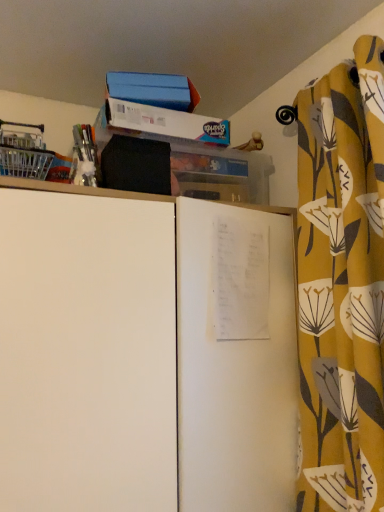
Question: In terms of size, does white matte cabinet at center appear bigger or smaller than yellow floral fabric curtain at right?

Choices:
 (A) big
 (B) small

Answer: (A)

Question: From a real-world perspective, is white matte cabinet at center positioned above or below yellow floral fabric curtain at right?

Choices:
 (A) below
 (B) above

Answer: (A)

Question: Relative to yellow floral fabric curtain at right, is white matte cabinet at center in front or behind?

Choices:
 (A) front
 (B) behind

Answer: (A)

Question: Does point (329, 101) appear closer or farther from the camera than point (137, 434)?

Choices:
 (A) farther
 (B) closer

Answer: (A)

Question: Do you think yellow floral fabric curtain at right is within white matte cabinet at center, or outside of it?

Choices:
 (A) outside
 (B) inside

Answer: (A)

Question: Considering their positions, is yellow floral fabric curtain at right located in front of or behind white matte cabinet at center?

Choices:
 (A) front
 (B) behind

Answer: (B)

Question: Is yellow floral fabric curtain at right wider or thinner than white matte cabinet at center?

Choices:
 (A) thin
 (B) wide

Answer: (A)